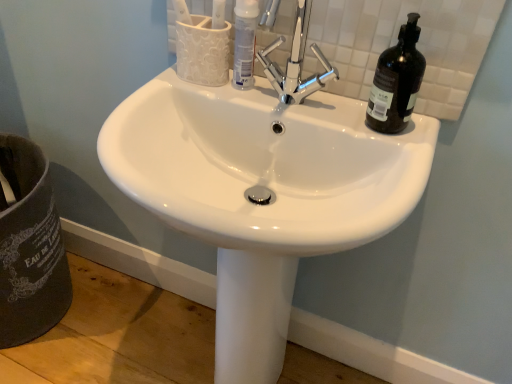
Locate an element on the screen. vacant space situated on the left part of black glass bottle at upper right is located at coordinates (311, 100).